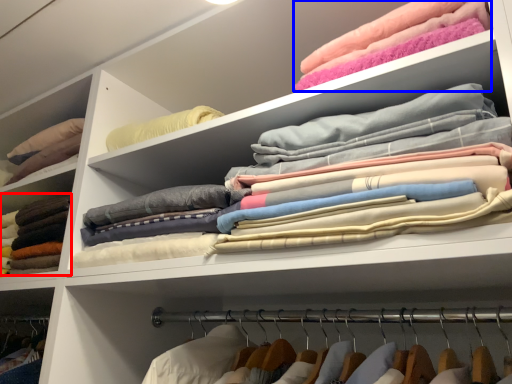
Question: Which object appears closest to the camera in this image, clothing (highlighted by a red box) or clothing (highlighted by a blue box)?

Choices:
 (A) clothing
 (B) clothing

Answer: (B)